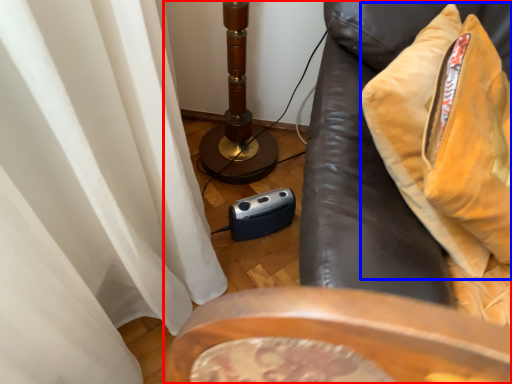
Question: Which of the following is the closest to the observer, furniture (highlighted by a red box) or throw pillow (highlighted by a blue box)?

Choices:
 (A) furniture
 (B) throw pillow

Answer: (A)